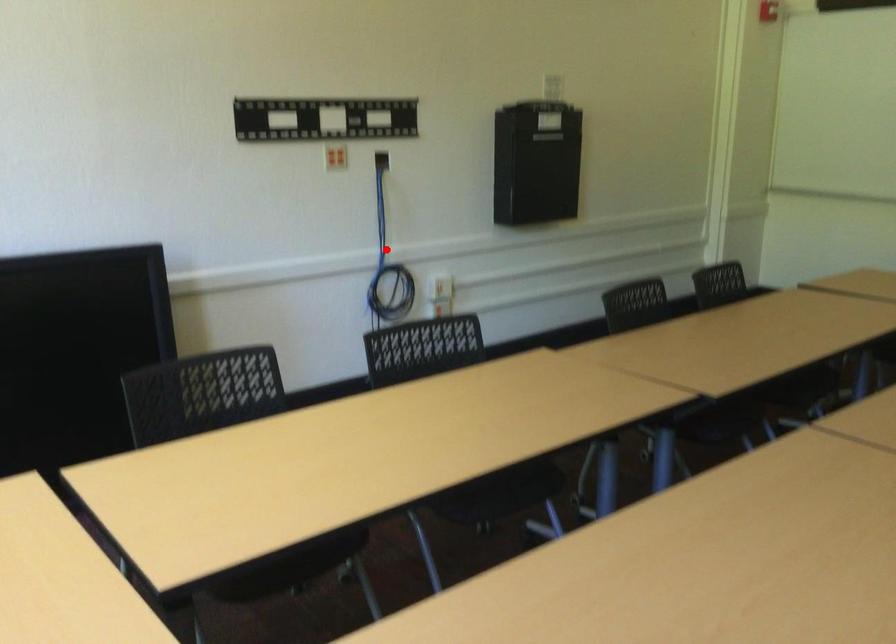
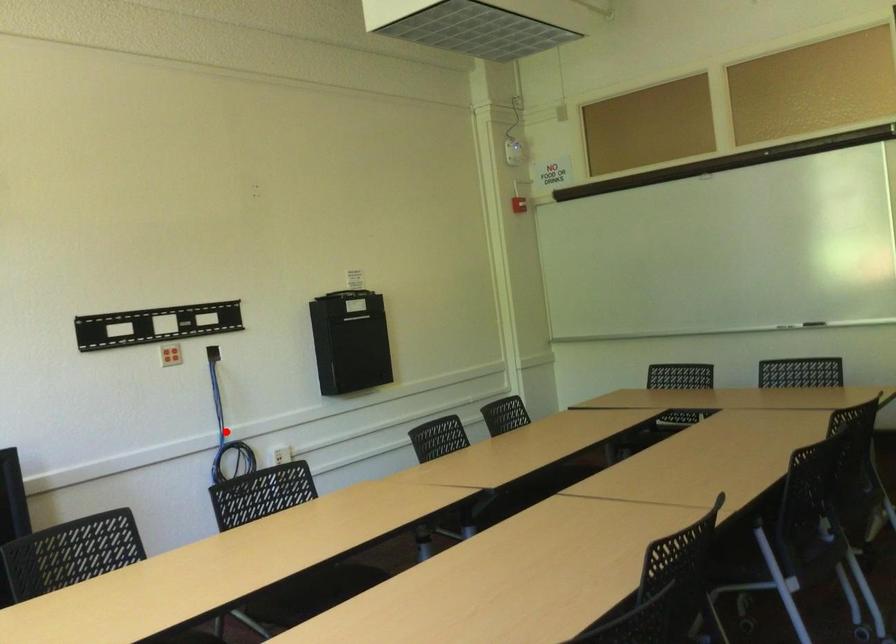
I am providing you with two images of the same scene from different viewpoints. A red point is marked on the first image and another point is marked on the second image. Are the points marked in image1 and image2 representing the same 3D position?

Yes